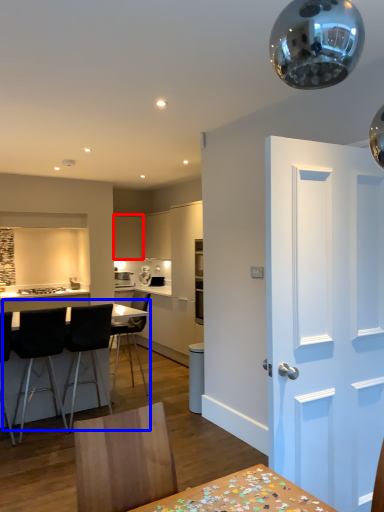
Question: Which object is further to the camera taking this photo, cabinetry (highlighted by a red box) or kitchen & dining room table (highlighted by a blue box)?

Choices:
 (A) cabinetry
 (B) kitchen & dining room table

Answer: (A)